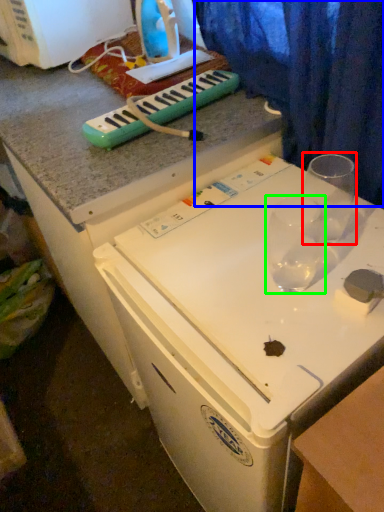
Question: Estimate the real-world distances between objects in this image. Which object is closer to martini glass (highlighted by a red box), curtain (highlighted by a blue box) or martini glass (highlighted by a green box)?

Choices:
 (A) curtain
 (B) martini glass

Answer: (B)